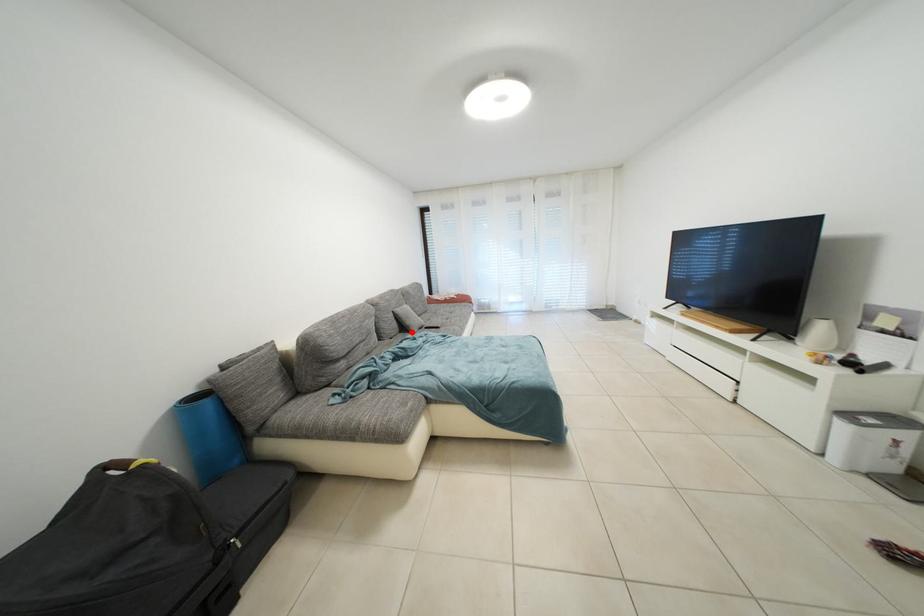
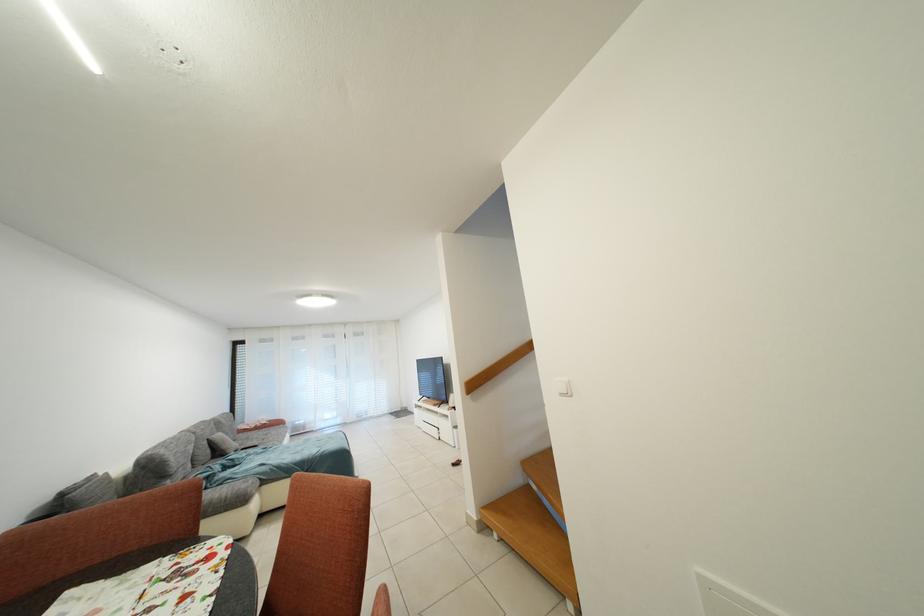
Question: I am providing you with two images of the same scene from different viewpoints. A red point is shown in image1. For the corresponding object point in image2, is it positioned nearer or farther from the camera?

Choices:
 (A) Nearer
 (B) Farther

Answer: (B)